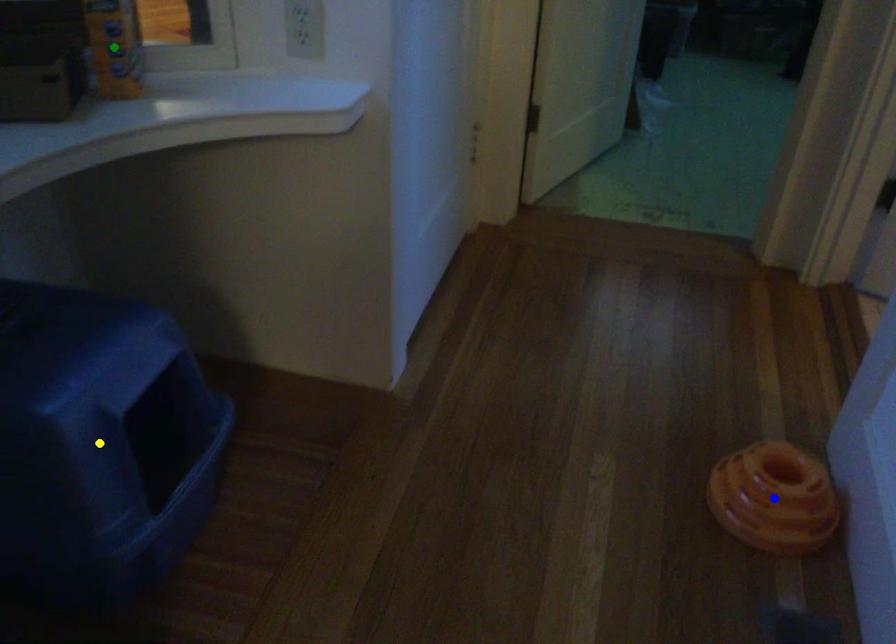
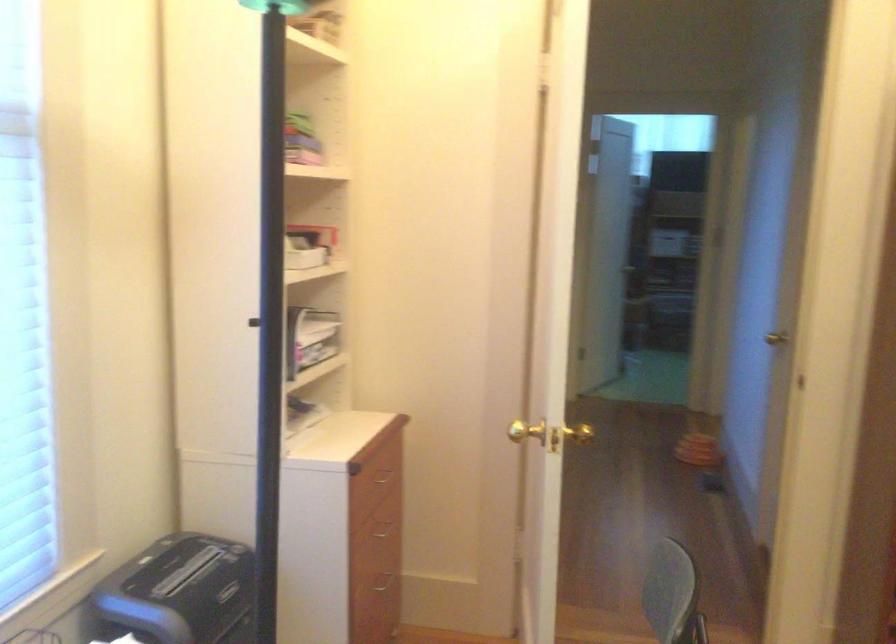
I am providing you with two images of the same scene from different viewpoints. Three points are marked in image1. Which point corresponds to a part or object that is occluded in image2?In image1, three points are marked. Which of them correspond to a part or object that is occluded in image2?Among the three points shown in image1, which one corresponds to a part or object that is no longer visible due to occlusion in image2?

Invisible in image2: green point, yellow point, blue point.